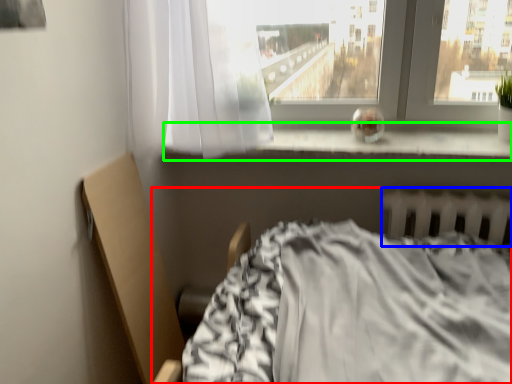
Question: Considering the real-world distances, which object is farthest from bed (highlighted by a red box)? radiator (highlighted by a blue box) or window sill (highlighted by a green box)?

Choices:
 (A) radiator
 (B) window sill

Answer: (B)